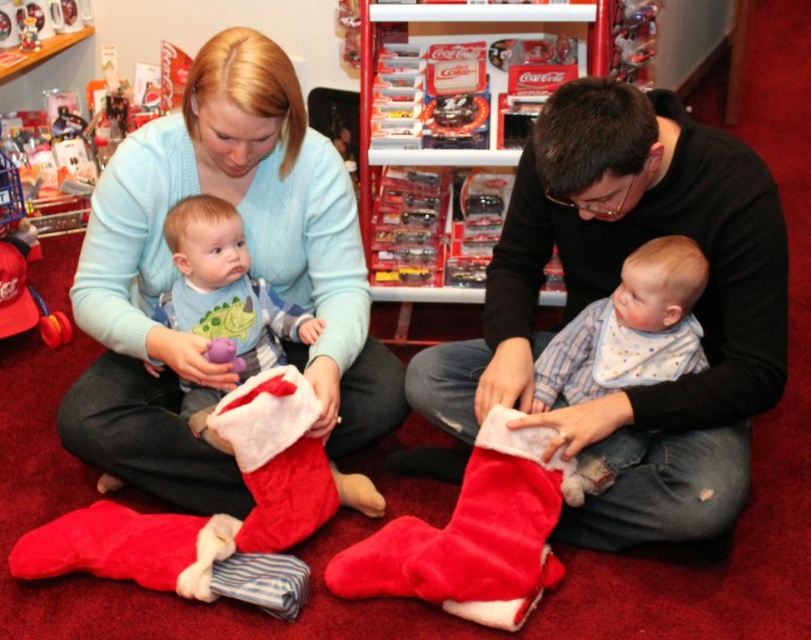
Consider the image. You are a delivery person who needs to place a small gift into the stocking at point (x=610, y=292). Based on the scene description, can you confirm if there is space available at that exact coordinate to place the gift?

Yes, the velvet red stocking at lower center is located at point (x=610, y=292), so there is space available to place the gift there.

You are a store employee who needs to place the matte plush baby at center and the matte purple plush toy at center on a shelf that can only hold items up to 12 inches in width. Based on the image, can both items fit side by side on the shelf?

The matte plush baby at center might be wider than matte purple plush toy at center, so it is uncertain if both will fit side by side on the 12 inches wide shelf without exceeding the width limit.